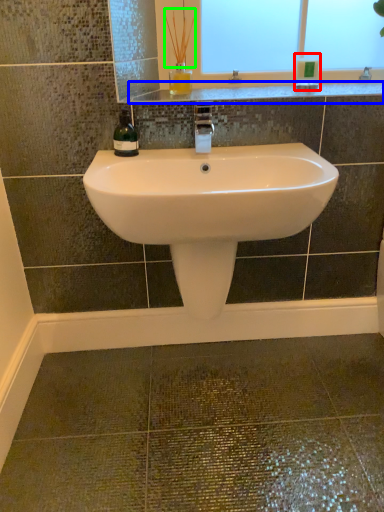
Question: Which is farther away from toiletry (highlighted by a red box)? counter top (highlighted by a blue box) or plant (highlighted by a green box)?

Choices:
 (A) counter top
 (B) plant

Answer: (B)